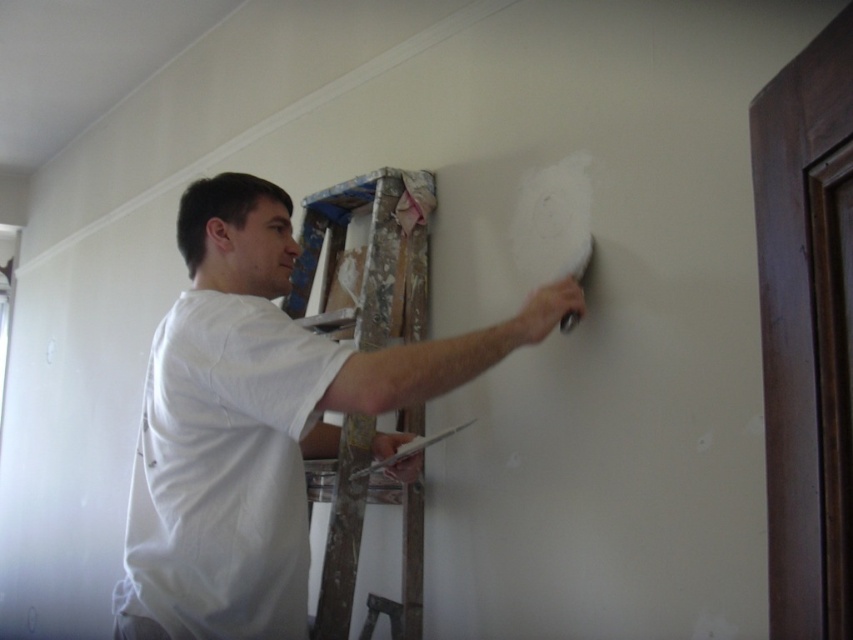
Consider the image. You are a contractor inspecting a work area. You notice a point at coordinates (259,420) in the scene. What object is located at that point?

The point at coordinates (259,420) corresponds to the white matte t shirt at center.

You are a construction inspector reviewing the site safety. You notice a point at coordinate (259, 420) on the image. What object is located at this coordinate?

The point at coordinate (259, 420) corresponds to the white matte t shirt at center.